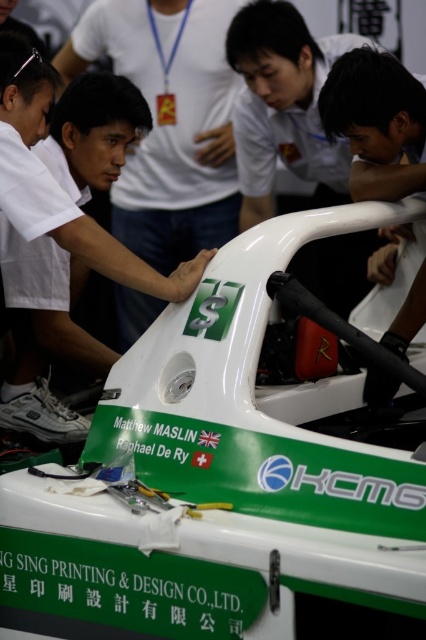
Question: Which point is farther to the camera?

Choices:
 (A) matte white helmet at center
 (B) matte white shirt at center
 (C) white glossy car at center

Answer: (B)

Question: Is white glossy car at center below matte white helmet at center?

Choices:
 (A) yes
 (B) no

Answer: (A)

Question: Can you confirm if white glossy car at center is wider than matte white shirt at center?

Choices:
 (A) no
 (B) yes

Answer: (A)

Question: Which is farther from the matte white helmet at center?

Choices:
 (A) white glossy car at center
 (B) matte white shirt at center

Answer: (B)

Question: Which point is farther to the camera?

Choices:
 (A) (207, 189)
 (B) (374, 593)

Answer: (A)

Question: Is white glossy car at center closer to the viewer compared to matte white helmet at center?

Choices:
 (A) no
 (B) yes

Answer: (A)